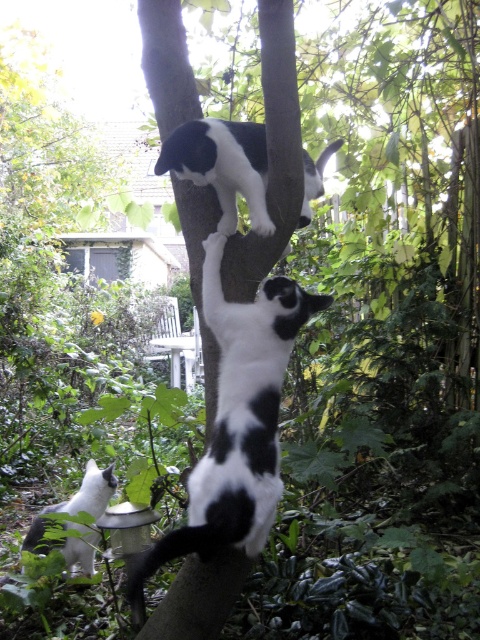
Is black and white fur cat at center wider than white soft fur cat at lower left?

Correct, the width of black and white fur cat at center exceeds that of white soft fur cat at lower left.

Is black and white fur cat at center closer to the viewer compared to white soft fur cat at lower left?

Yes, it is.

Locate an element on the screen. The width and height of the screenshot is (480, 640). black and white fur cat at center is located at coordinates tap(238, 419).

Is black and white fur cat at upper center further to camera compared to white soft fur cat at lower left?

No, it is in front of white soft fur cat at lower left.

Which is more to the right, black and white fur cat at upper center or white soft fur cat at lower left?

From the viewer's perspective, black and white fur cat at upper center appears more on the right side.

I want to click on black and white fur cat at upper center, so click(x=223, y=164).

Does black and white fur cat at center appear on the left side of black and white fur cat at upper center?

Yes, black and white fur cat at center is to the left of black and white fur cat at upper center.

At what (x,y) coordinates should I click in order to perform the action: click on black and white fur cat at center. Please return your answer as a coordinate pair (x, y). Looking at the image, I should click on (238, 419).